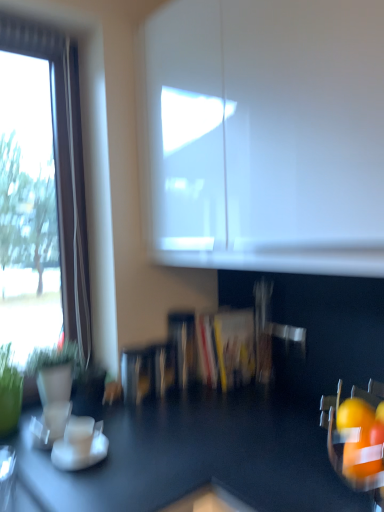
Describe the element at coordinates (226, 348) in the screenshot. This screenshot has width=384, height=512. I see `hardcover book at center` at that location.

Consider the image. In order to face hardcover book at center, should I rotate leftwards or rightwards?

Rotate your view right by about 4.696°.

Image resolution: width=384 pixels, height=512 pixels. In order to click on hardcover book at center in this screenshot , I will do `click(226, 348)`.

Locate an element on the screen. The width and height of the screenshot is (384, 512). hardcover book at center is located at coordinates (226, 348).